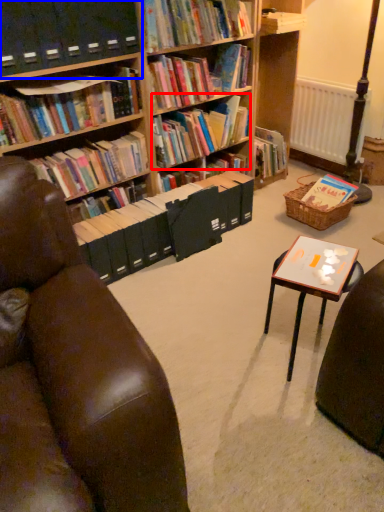
Question: Among these objects, which one is nearest to the camera, book (highlighted by a red box) or shelf (highlighted by a blue box)?

Choices:
 (A) book
 (B) shelf

Answer: (B)